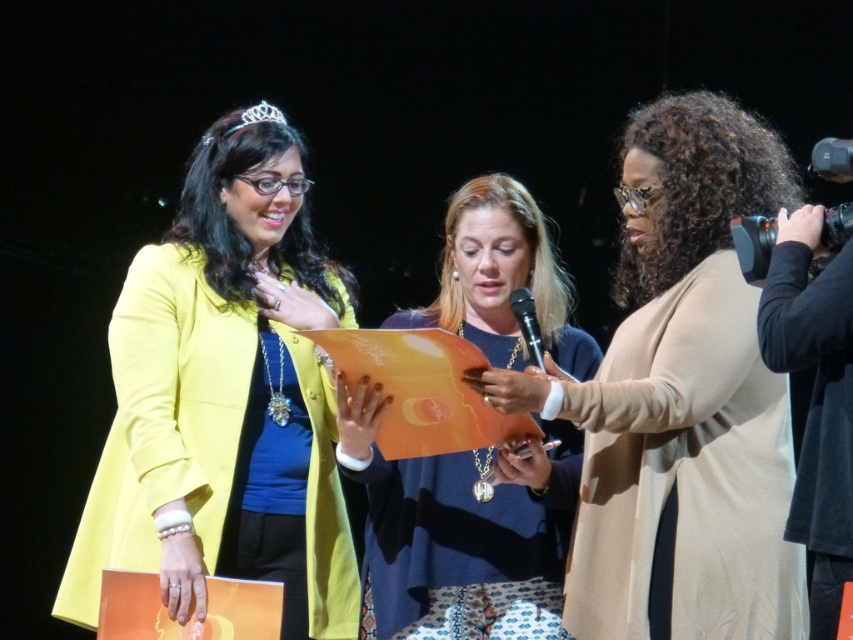
Question: Which point is farther to the camera?

Choices:
 (A) (235, 502)
 (B) (479, 534)

Answer: (A)

Question: From the image, what is the correct spatial relationship of beige fabric coat at center in relation to matte orange paper at center?

Choices:
 (A) left
 (B) right

Answer: (B)

Question: Does beige fabric coat at center appear on the left side of matte orange paper at center?

Choices:
 (A) yes
 (B) no

Answer: (B)

Question: Among these points, which one is farthest from the camera?

Choices:
 (A) (216, 508)
 (B) (508, 186)

Answer: (B)

Question: Where is matte yellow jacket at center located in relation to beige fabric coat at center in the image?

Choices:
 (A) above
 (B) below

Answer: (B)

Question: Which point is farther to the camera?

Choices:
 (A) matte orange paper at center
 (B) beige fabric coat at center
 (C) matte yellow jacket at center

Answer: (C)